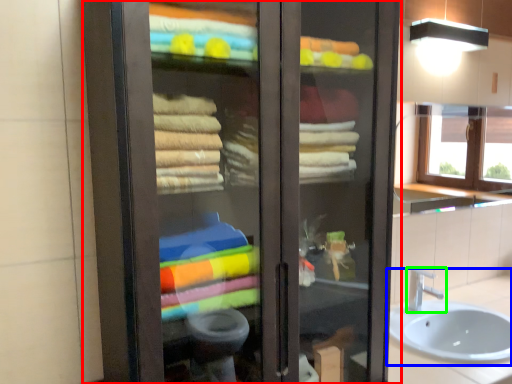
Question: Estimate the real-world distances between objects in this image. Which object is farther from bathroom cabinet (highlighted by a red box), sink (highlighted by a blue box) or tap (highlighted by a green box)?

Choices:
 (A) sink
 (B) tap

Answer: (B)